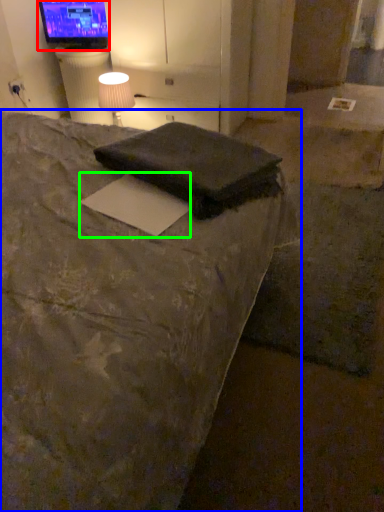
Question: Which object is positioned closest to television (highlighted by a red box)? Select from bed (highlighted by a blue box) and paper (highlighted by a green box).

Choices:
 (A) bed
 (B) paper

Answer: (A)